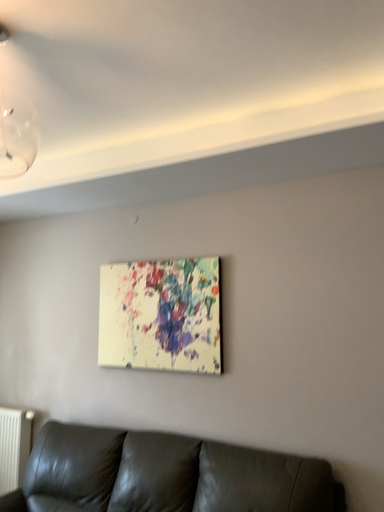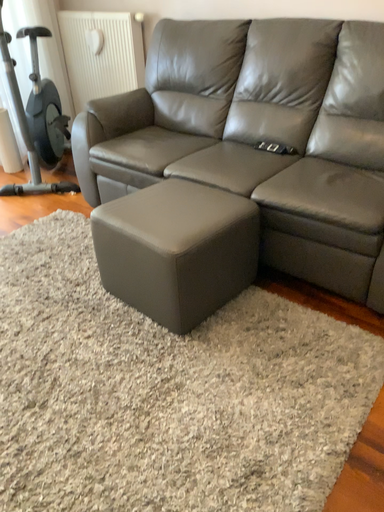
Question: Which way did the camera rotate in the video?

Choices:
 (A) rotated downward
 (B) rotated upward

Answer: (A)